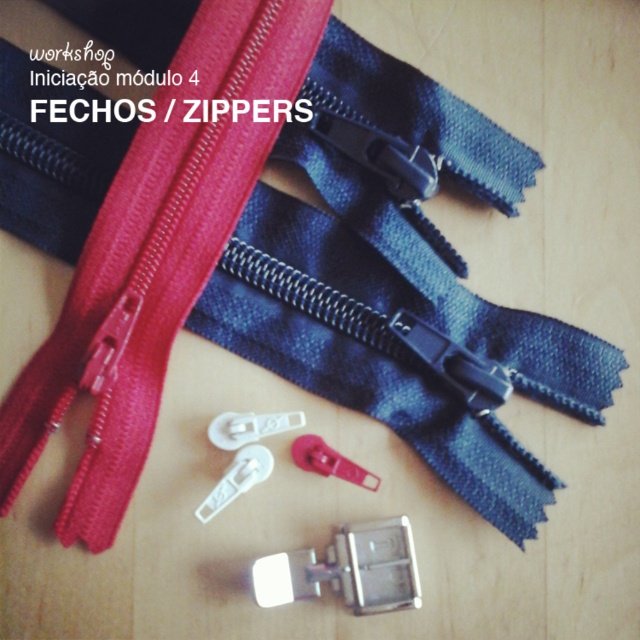
Between point (288, 44) and point (196, 513), which one is positioned in front?

Point (196, 513) is in front.

Is red matte zipper at center further to the viewer compared to white plastic zipper slider at center?

That is False.

Is point (108, 209) closer to camera compared to point (252, 449)?

Yes, point (108, 209) is closer to viewer.

The height and width of the screenshot is (640, 640). What are the coordinates of `red matte zipper at center` in the screenshot? It's located at (154, 257).

Who is taller, red matte zipper at center or matte plastic zipper slider at center?

red matte zipper at center

Measure the distance from red matte zipper at center to matte plastic zipper slider at center.

red matte zipper at center and matte plastic zipper slider at center are 14.07 inches apart.

Which is behind, point (125, 316) or point (365, 476)?

Point (365, 476)

This screenshot has width=640, height=640. In order to click on red matte zipper at center in this screenshot , I will do `click(154, 257)`.

You are a GUI agent. You are given a task and a screenshot of the screen. Output one action in this format:
    pyautogui.click(x=<x>, y=<y>)
    Task: Click on the red matte zipper at center
    This screenshot has height=640, width=640.
    Given the screenshot: What is the action you would take?
    pyautogui.click(x=154, y=257)

Identify the location of red matte zipper at center. The height and width of the screenshot is (640, 640). (154, 257).

Image resolution: width=640 pixels, height=640 pixels. Find the location of `red matte zipper at center`. red matte zipper at center is located at coordinates (154, 257).